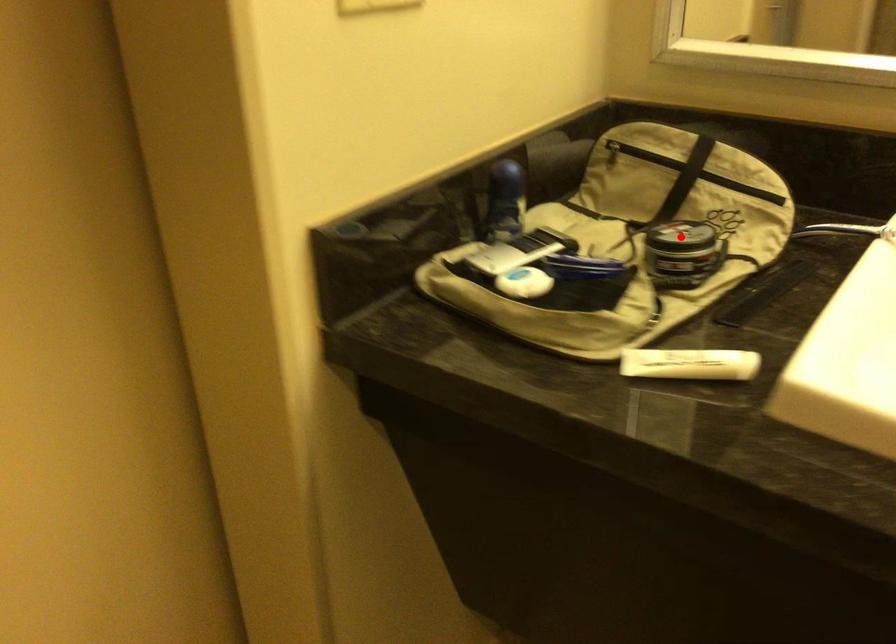
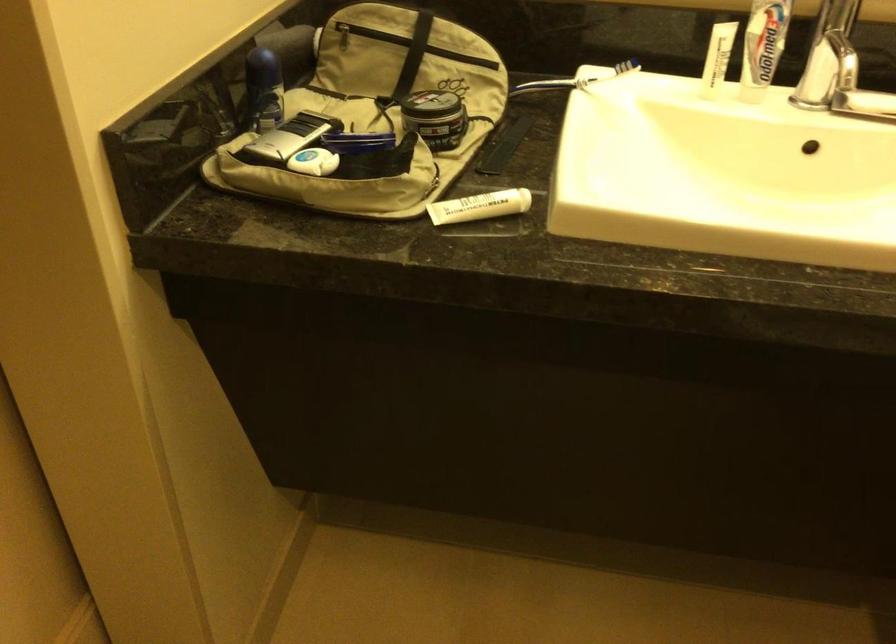
Question: I am providing you with two images of the same scene from different viewpoints. In image1, a red point is highlighted. Considering the same 3D point in image2, which of the following is correct?

Choices:
 (A) It is closer
 (B) It is farther

Answer: (B)